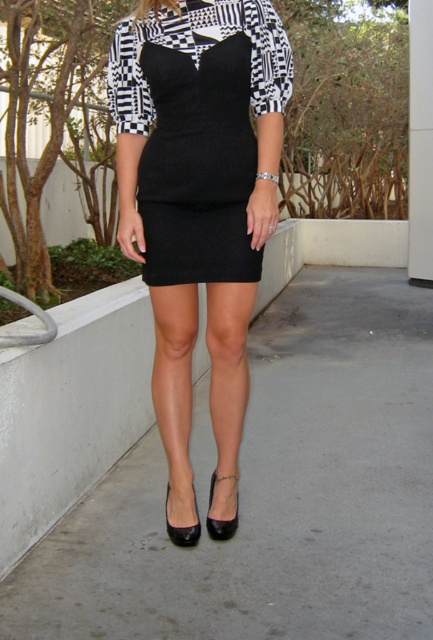
Question: Among these points, which one is farthest from the camera?

Choices:
 (A) (213, 483)
 (B) (184, 288)
 (C) (165, 508)
 (D) (423, 129)

Answer: (D)

Question: Estimate the real-world distances between objects in this image. Which object is farther from the black leather sandal at lower center?

Choices:
 (A) black leather high-heeled shoe at lower center
 (B) satin black dress at center

Answer: (B)

Question: Observing the image, what is the correct spatial positioning of satin black dress at center in reference to black leather sandal at lower center?

Choices:
 (A) left
 (B) right

Answer: (B)

Question: Does satin black dress at center have a greater width compared to white glossy pillar at right?

Choices:
 (A) no
 (B) yes

Answer: (B)

Question: Is white glossy pillar at right in front of black leather high-heeled shoe at lower center?

Choices:
 (A) no
 (B) yes

Answer: (A)

Question: Which point is farther to the camera?

Choices:
 (A) satin black dress at center
 (B) white glossy pillar at right

Answer: (B)